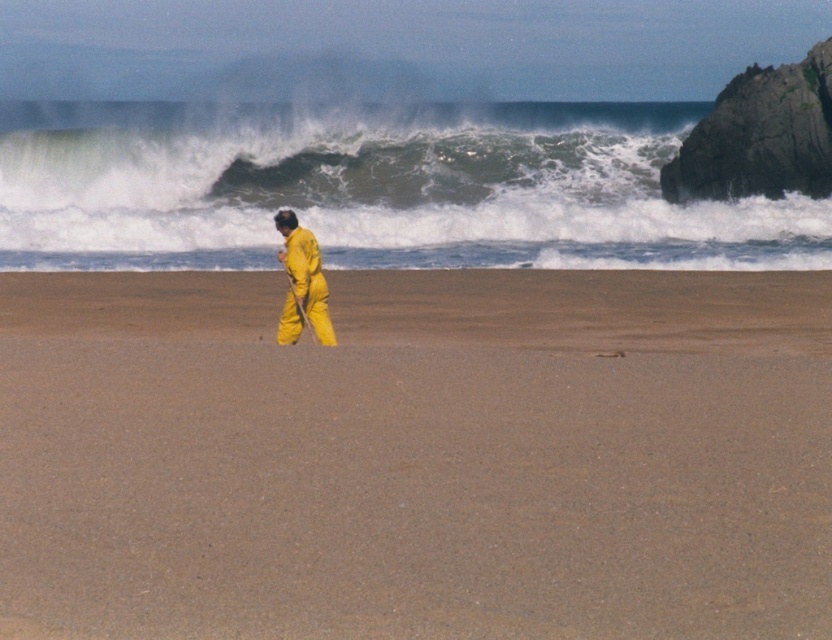
You are a photographer trying to capture the contrast between the smooth sand at center and the white frothy water at upper center. Where should you position your camera relative to these two elements to best highlight their contrast?

Position your camera so that it faces downward toward the smooth sand at center, which is below the white frothy water at upper center. This angle will emphasize the contrast between the two elements by showing the sand beneath the frothy water.

You are a photographer planning to capture a wide landscape shot of the beach scene described. You need to ensure that the yellow matte jumpsuit at center and the smooth sand at center are both prominently featured. Given their relative sizes, which object will occupy more space in the photo?

The smooth sand at center occupies more space in the photo because its width is larger than that of the yellow matte jumpsuit at center.